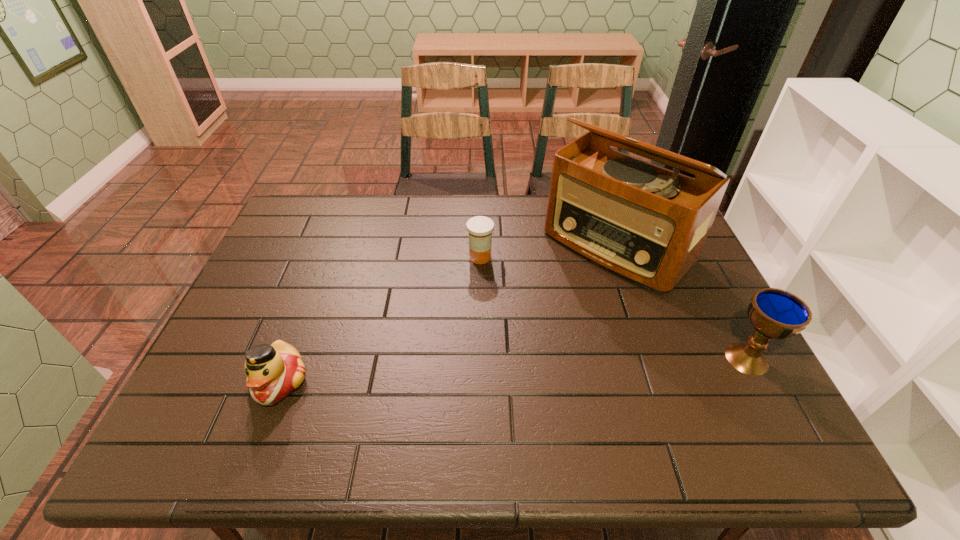
The image size is (960, 540). What are the coordinates of `vacant space at the far edge of the desktop` in the screenshot? It's located at (372, 221).

At what (x,y) coordinates should I click in order to perform the action: click on blank space at the near edge of the desktop. Please return your answer as a coordinate pair (x, y). Looking at the image, I should click on (471, 381).

The width and height of the screenshot is (960, 540). I want to click on free space at the left edge, so click(x=244, y=338).

Identify the location of free space at the right edge of the desktop. The image size is (960, 540). pos(725,373).

Find the location of a particular element. blank space at the far left corner of the desktop is located at coordinates (289, 220).

Locate an element on the screen. The image size is (960, 540). vacant space at the near left corner of the desktop is located at coordinates (201, 396).

Identify the location of free space that is in between the second object from left to right and the radio receiver. The image size is (960, 540). click(x=549, y=251).

Identify the location of free point between the medicine and the tallest object. The width and height of the screenshot is (960, 540). (549, 251).

Identify the location of empty space between the radio receiver and the duck. Image resolution: width=960 pixels, height=540 pixels. (448, 313).

Where is `blank region between the tallest object and the chalice`? blank region between the tallest object and the chalice is located at coordinates (682, 302).